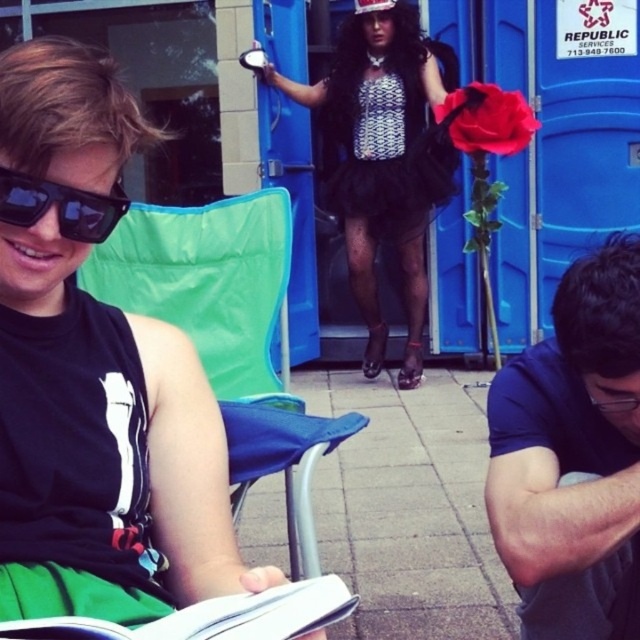
Question: Which of these objects is positioned farthest from the black sequined dress at center?

Choices:
 (A) black matte sunglasses at left
 (B) white paper book at lower left
 (C) black tulle skirt at center
 (D) blue fabric shirt at lower right

Answer: (B)

Question: Is black matte sunglasses at upper left positioned at the back of green fabric chair at center?

Choices:
 (A) yes
 (B) no

Answer: (B)

Question: Is black matte sunglasses at upper left bigger than green fabric chair at center?

Choices:
 (A) no
 (B) yes

Answer: (A)

Question: Is green fabric chair at center closer to the viewer compared to black tulle skirt at center?

Choices:
 (A) no
 (B) yes

Answer: (B)

Question: Which point is closer to the camera?

Choices:
 (A) black matte sunglasses at left
 (B) black matte sunglasses at upper left
 (C) green fabric chair at center
 (D) white paper book at lower left

Answer: (D)

Question: Which is nearer to the blue fabric shirt at lower right?

Choices:
 (A) green fabric chair at center
 (B) black tulle skirt at center
 (C) black sequined dress at center
 (D) black matte sunglasses at left

Answer: (A)